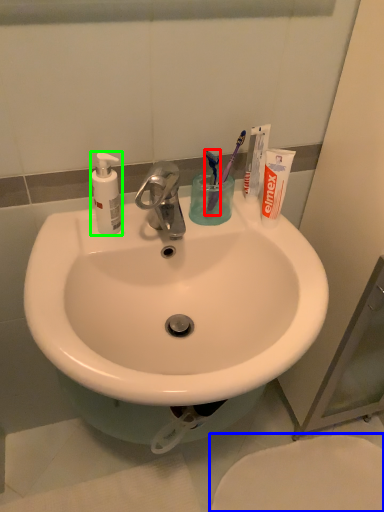
Question: Estimate the real-world distances between objects in this image. Which object is closer to toothbrush (highlighted by a red box), toilet (highlighted by a blue box) or soap dispenser (highlighted by a green box)?

Choices:
 (A) toilet
 (B) soap dispenser

Answer: (B)